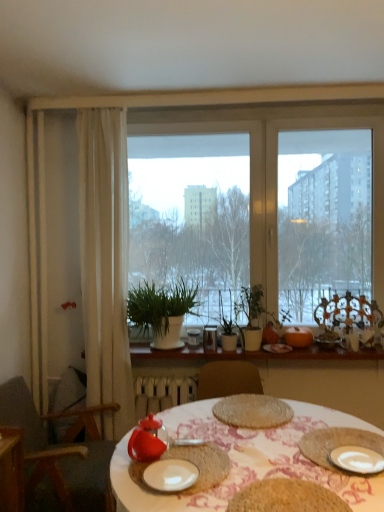
Where is `free space in front of baked golden bread at center, which is the first food from back to front`? The image size is (384, 512). free space in front of baked golden bread at center, which is the first food from back to front is located at coordinates (236, 441).